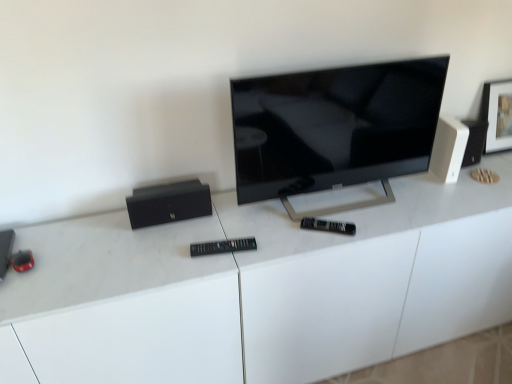
Question: Could you tell me if white glossy desk at center is facing black matte speaker at left, positioned as the 2th speaker in right-to-left order?

Choices:
 (A) no
 (B) yes

Answer: (A)

Question: From a real-world perspective, is white glossy desk at center located beneath black matte speaker at left, marked as the second speaker in a bottom-to-top arrangement?

Choices:
 (A) yes
 (B) no

Answer: (A)

Question: Considering the relative positions of white glossy desk at center and black matte speaker at left, marked as the second speaker in a bottom-to-top arrangement, in the image provided, is white glossy desk at center to the right of black matte speaker at left, marked as the second speaker in a bottom-to-top arrangement, from the viewer's perspective?

Choices:
 (A) no
 (B) yes

Answer: (B)

Question: Is black matte speaker at left, the 2th speaker from the left, located within white glossy desk at center?

Choices:
 (A) no
 (B) yes

Answer: (A)

Question: Considering the relative sizes of white glossy desk at center and black matte speaker at left, marked as the second speaker in a bottom-to-top arrangement, in the image provided, is white glossy desk at center smaller than black matte speaker at left, marked as the second speaker in a bottom-to-top arrangement,?

Choices:
 (A) yes
 (B) no

Answer: (B)

Question: From the image's perspective, is white glossy desk at center on black matte speaker at left, acting as the 2th speaker starting from the top?

Choices:
 (A) no
 (B) yes

Answer: (A)

Question: From the image's perspective, does black plastic remote at center appear lower than metallic black speaker at left, which is the third speaker in right-to-left order?

Choices:
 (A) no
 (B) yes

Answer: (A)

Question: Is black plastic remote at center touching metallic black speaker at left, which is the third speaker in right-to-left order?

Choices:
 (A) yes
 (B) no

Answer: (B)

Question: Considering the relative positions of black plastic remote at center and metallic black speaker at left, the 1th speaker when ordered from left to right, in the image provided, is black plastic remote at center to the right of metallic black speaker at left, the 1th speaker when ordered from left to right, from the viewer's perspective?

Choices:
 (A) yes
 (B) no

Answer: (A)

Question: Is black plastic remote at center oriented towards metallic black speaker at left, which is the third speaker in right-to-left order?

Choices:
 (A) no
 (B) yes

Answer: (A)

Question: Is black plastic remote at center further to camera compared to metallic black speaker at left, which is the third speaker in right-to-left order?

Choices:
 (A) yes
 (B) no

Answer: (A)

Question: From a real-world perspective, is black plastic remote at center below metallic black speaker at left, marked as the 3th speaker in a top-to-bottom arrangement?

Choices:
 (A) no
 (B) yes

Answer: (A)

Question: Does black matte speaker at left, the 2th speaker from the left, appear on the left side of black plastic remote at center?

Choices:
 (A) yes
 (B) no

Answer: (A)